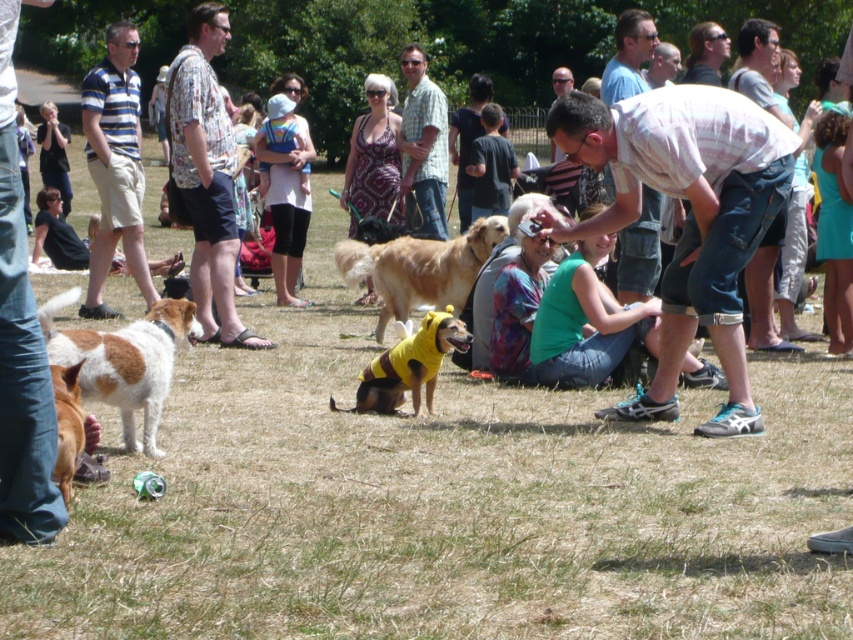
Question: Is denim jeans at lower left to the left of matte white shirt at center from the viewer's perspective?

Choices:
 (A) yes
 (B) no

Answer: (A)

Question: Which point is farther to the camera?

Choices:
 (A) white striped shirt at upper right
 (B) denim jeans at lower left

Answer: (A)

Question: Does brown and white fur dog at lower left appear on the left side of matte white shirt at center?

Choices:
 (A) yes
 (B) no

Answer: (A)

Question: Which of the following is the farthest from the observer?

Choices:
 (A) golden fur dog at center
 (B) white striped shirt at upper right

Answer: (A)

Question: Which object appears closest to the camera in this image?

Choices:
 (A) matte white shirt at center
 (B) denim jeans at lower left
 (C) light brown hair at upper center
 (D) white striped shirt at upper right

Answer: (B)

Question: Is printed cotton shirt at center below light brown shirt at center?

Choices:
 (A) yes
 (B) no

Answer: (A)